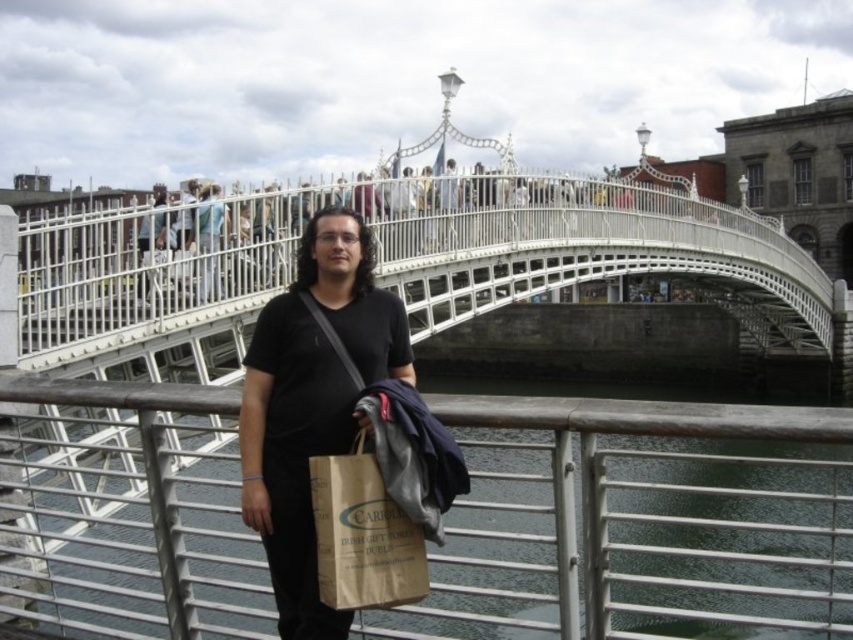
Question: In this image, where is greenish water at bridge center located relative to black matte shirt at center?

Choices:
 (A) right
 (B) left

Answer: (A)

Question: Is greenish water at bridge center wider than black matte shirt at center?

Choices:
 (A) yes
 (B) no

Answer: (A)

Question: Is white metal bridge at center thinner than matte black shirt at center?

Choices:
 (A) yes
 (B) no

Answer: (B)

Question: Among these points, which one is farthest from the camera?

Choices:
 (A) (111, 288)
 (B) (305, 417)
 (C) (206, 232)
 (D) (579, 472)

Answer: (C)

Question: Which point appears closest to the camera in this image?

Choices:
 (A) (283, 493)
 (B) (140, 284)

Answer: (A)

Question: Among these objects, which one is nearest to the camera?

Choices:
 (A) white metal bridge at center
 (B) black matte shirt at center

Answer: (B)